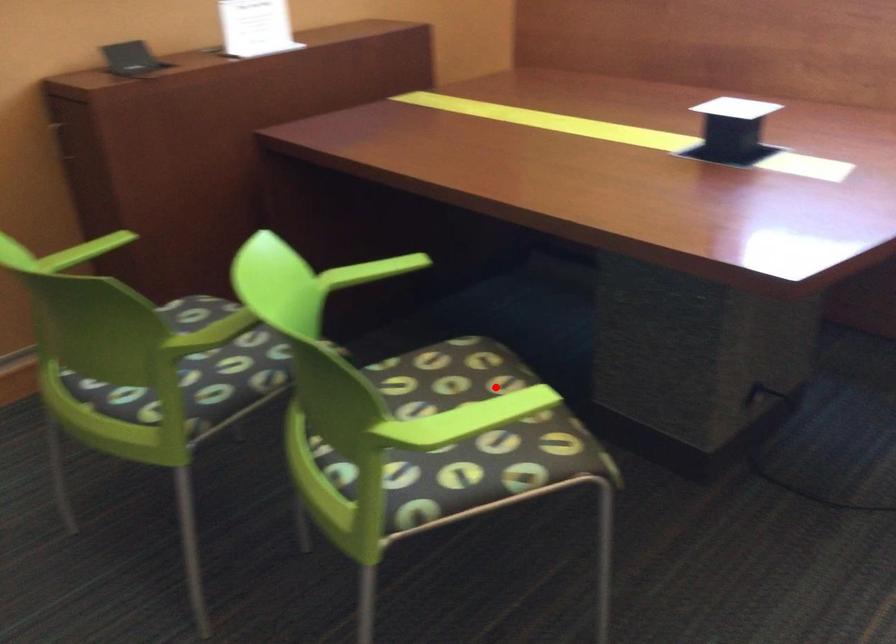
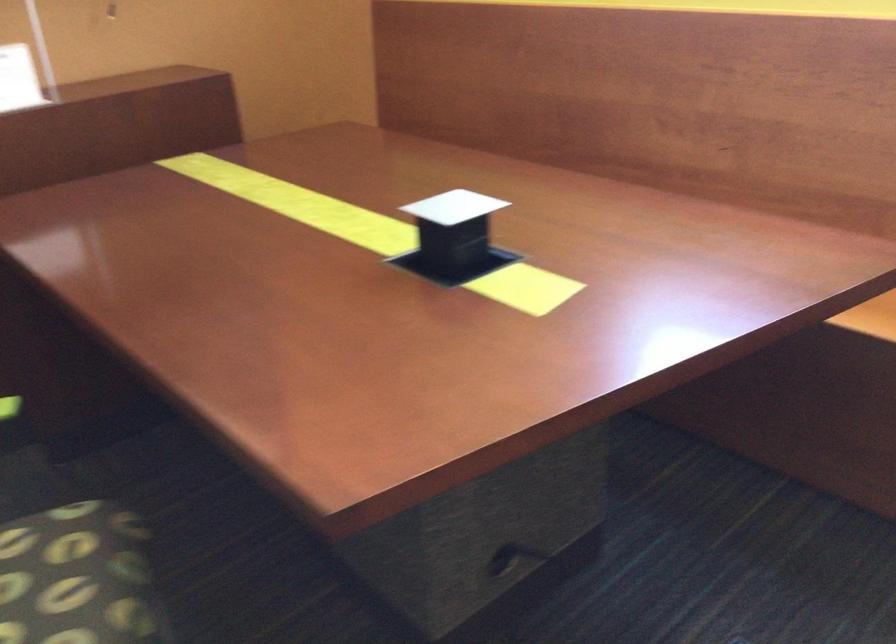
Where in the second image is the point corresponding to the highlighted location from the first image?

(74, 576)